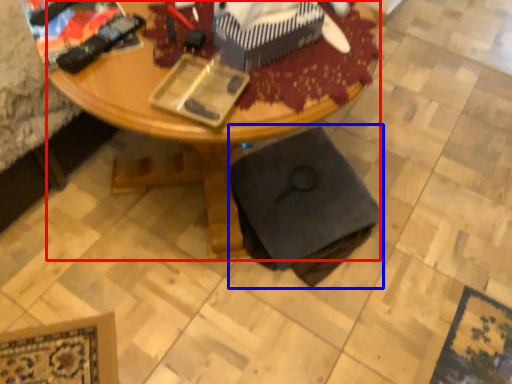
Question: Which object appears closest to the camera in this image, desk (highlighted by a red box) or swivel chair (highlighted by a blue box)?

Choices:
 (A) desk
 (B) swivel chair

Answer: (A)